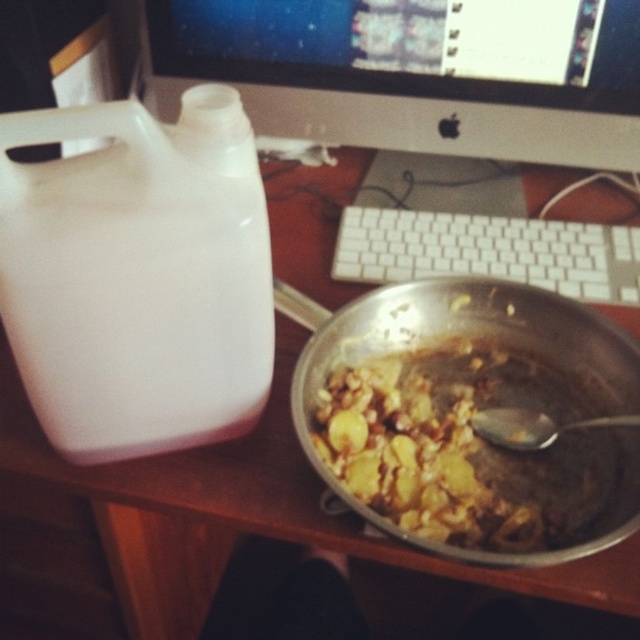
Question: Among these points, which one is farthest from the camera?

Choices:
 (A) (444, 58)
 (B) (531, 468)
 (C) (570, 252)

Answer: (C)

Question: From the image, what is the correct spatial relationship of golden brown textured food at center in relation to white plastic keyboard at center?

Choices:
 (A) below
 (B) above

Answer: (A)

Question: Does white plastic monitor at upper center have a lesser width compared to metallic spoon at bowl right?

Choices:
 (A) yes
 (B) no

Answer: (B)

Question: Which object is farther from the camera taking this photo?

Choices:
 (A) white plastic keyboard at center
 (B) metallic spoon at bowl right
 (C) white plastic monitor at upper center

Answer: (A)

Question: Can you confirm if golden brown textured food at center is smaller than white plastic keyboard at center?

Choices:
 (A) yes
 (B) no

Answer: (B)

Question: Which is nearer to the white plastic keyboard at center?

Choices:
 (A) white plastic monitor at upper center
 (B) golden brown textured food at center

Answer: (A)